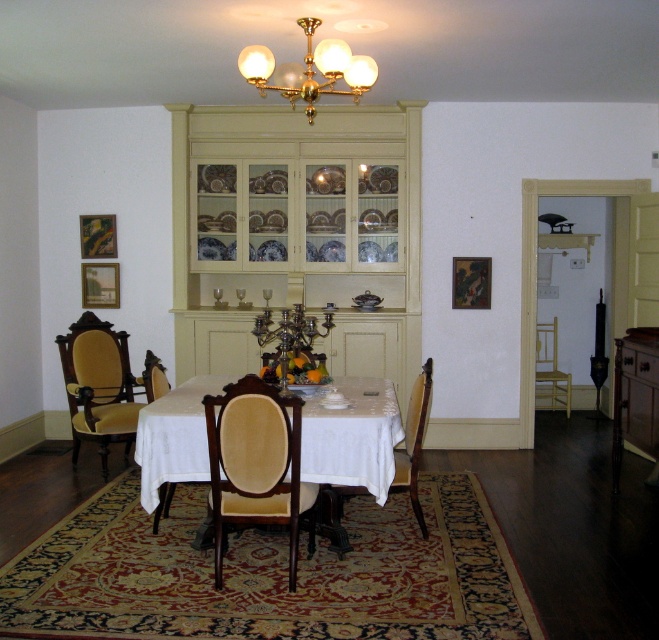
Question: Does velvet upholstered chair at center appear on the right side of velvet upholstered chair at left?

Choices:
 (A) no
 (B) yes

Answer: (B)

Question: Which of the following is the farthest from the observer?

Choices:
 (A) (563, 387)
 (B) (107, 344)

Answer: (A)

Question: In this image, where is white cloth-covered table at center located relative to light brown wood chair at right?

Choices:
 (A) right
 (B) left

Answer: (B)

Question: Can you confirm if velvet upholstered chair at center is bigger than gold brass chandelier at upper center?

Choices:
 (A) yes
 (B) no

Answer: (A)

Question: Among these objects, which one is nearest to the camera?

Choices:
 (A) wooden chair at table
 (B) velvet upholstered chair at center
 (C) velvet upholstered chair at left
 (D) gold brass chandelier at upper center

Answer: (B)

Question: Among these points, which one is nearest to the camera?

Choices:
 (A) (221, 412)
 (B) (190, 401)

Answer: (A)